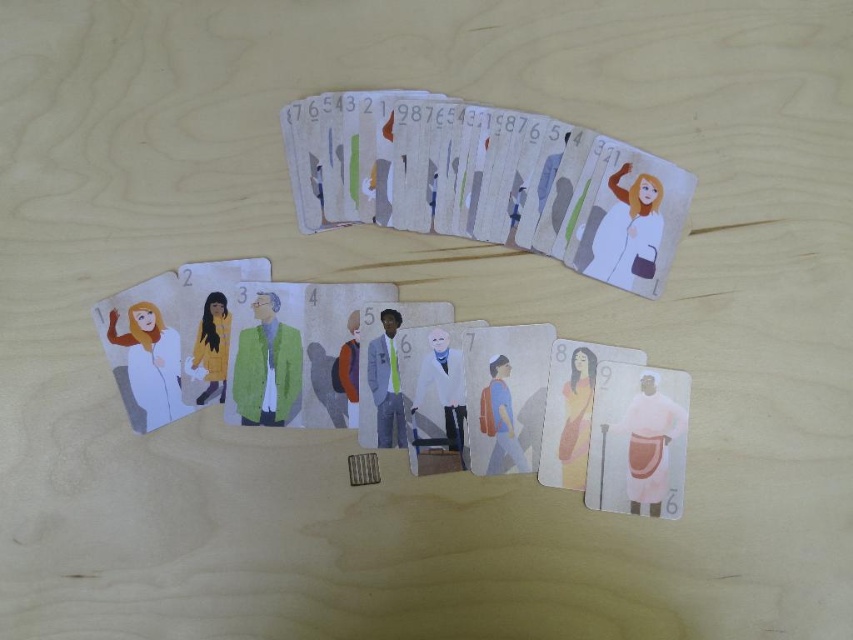
Does matte paper card at center come behind white matte lab coat at center?

That is False.

What do you see at coordinates (399, 378) in the screenshot?
I see `matte paper card at center` at bounding box center [399, 378].

You are a GUI agent. You are given a task and a screenshot of the screen. Output one action in this format:
    pyautogui.click(x=<x>, y=<y>)
    Task: Click on the matte paper card at center
    The width and height of the screenshot is (853, 640).
    Given the screenshot: What is the action you would take?
    pyautogui.click(x=399, y=378)

Who is shorter, green textured sweater at center or matte white robe at lower right?

green textured sweater at center

Who is lower down, green textured sweater at center or matte white robe at lower right?

matte white robe at lower right is lower down.

Where is `green textured sweater at center`? This screenshot has width=853, height=640. green textured sweater at center is located at coordinates (267, 365).

Locate an element on the screen. The image size is (853, 640). green textured sweater at center is located at coordinates (267, 365).

Does white matte lab coat at center have a greater width compared to light blue fabric suit at center?

Correct, the width of white matte lab coat at center exceeds that of light blue fabric suit at center.

Does point (448, 413) come in front of point (375, 355)?

Yes.

Between point (439, 348) and point (392, 384), which one is positioned behind?

The point (392, 384) is more distant.

This screenshot has height=640, width=853. What are the coordinates of `white matte lab coat at center` in the screenshot? It's located at [440, 387].